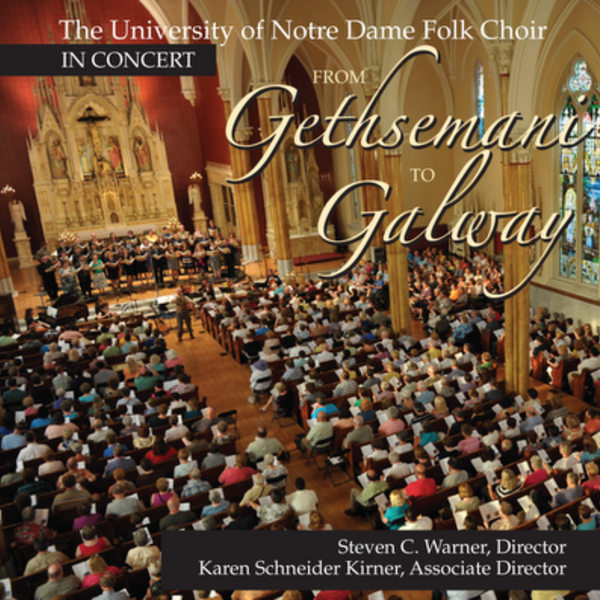
This screenshot has height=600, width=600. I want to click on statue, so click(20, 219), click(197, 199).